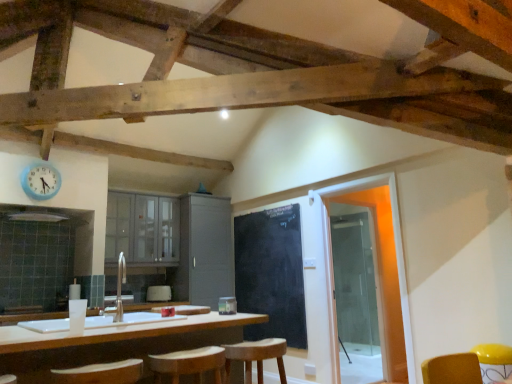
Where is `free spot above blue plastic clock at upper left (from a real-world perspective)`? free spot above blue plastic clock at upper left (from a real-world perspective) is located at coordinates (40, 164).